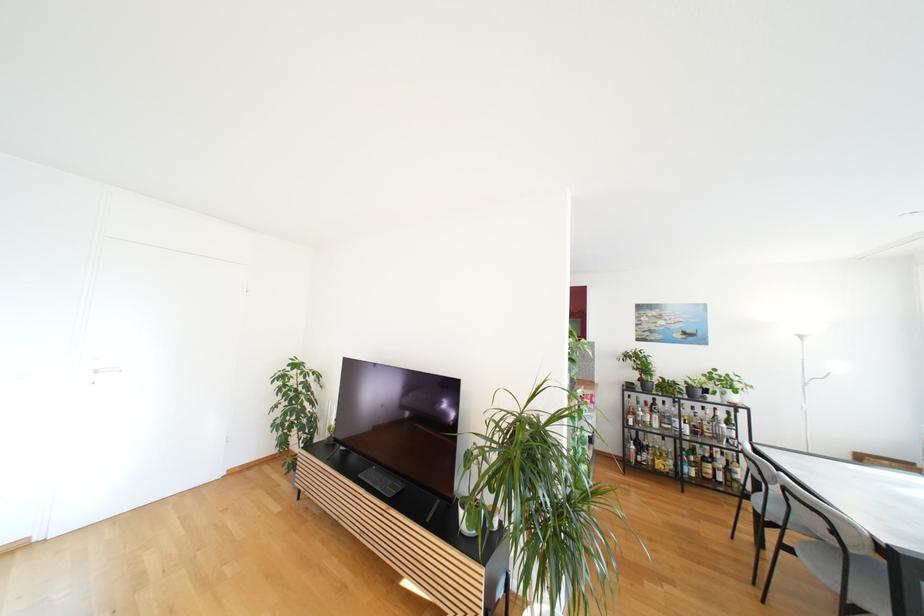
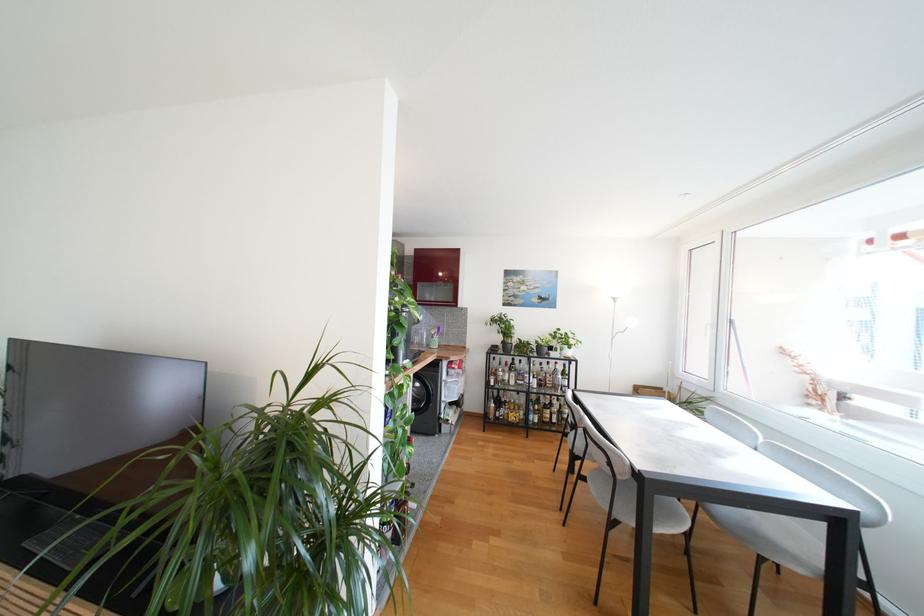
Question: I am providing you with two images of the same scene from different viewpoints. Which of the following objects are not visible in image2?

Choices:
 (A) glass bottle
 (B) utensil holder
 (C) grey chair sitting surface
 (D) none of these

Answer: (D)